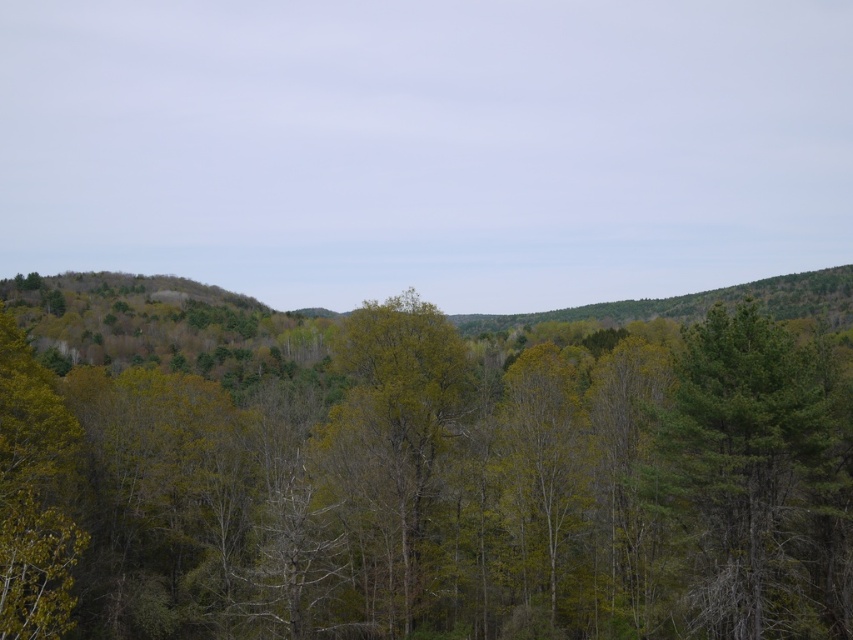
Question: Which point is farther from the camera taking this photo?

Choices:
 (A) (463, 586)
 (B) (796, 608)

Answer: (A)

Question: Is green matte tree at center to the left of green matte tree at right from the viewer's perspective?

Choices:
 (A) yes
 (B) no

Answer: (A)

Question: Does green matte tree at center come behind green matte tree at right?

Choices:
 (A) no
 (B) yes

Answer: (A)

Question: Which point is farther from the camera taking this photo?

Choices:
 (A) (41, 522)
 (B) (767, 493)

Answer: (B)

Question: Is green matte tree at center below green matte tree at right?

Choices:
 (A) yes
 (B) no

Answer: (B)